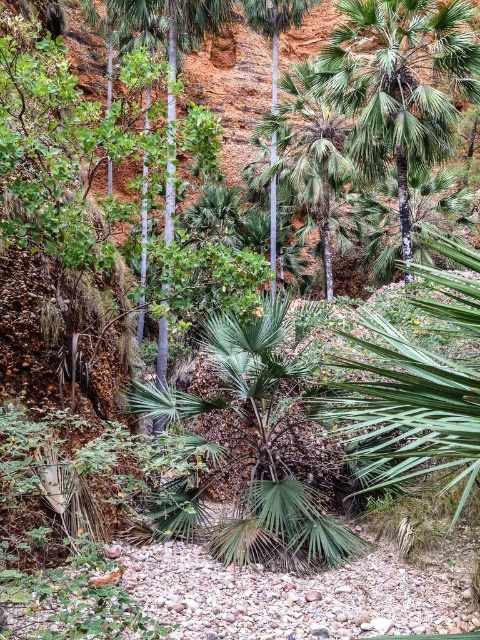
Does green leafy palm tree at upper center appear under green leafy palm tree at center?

Correct, green leafy palm tree at upper center is located below green leafy palm tree at center.

At what (x,y) coordinates should I click in order to perform the action: click on green leafy palm tree at upper center. Please return your answer as a coordinate pair (x, y). The width and height of the screenshot is (480, 640). Looking at the image, I should click on (400, 83).

Locate an element on the screen. Image resolution: width=480 pixels, height=640 pixels. green leafy palm tree at upper center is located at coordinates 400,83.